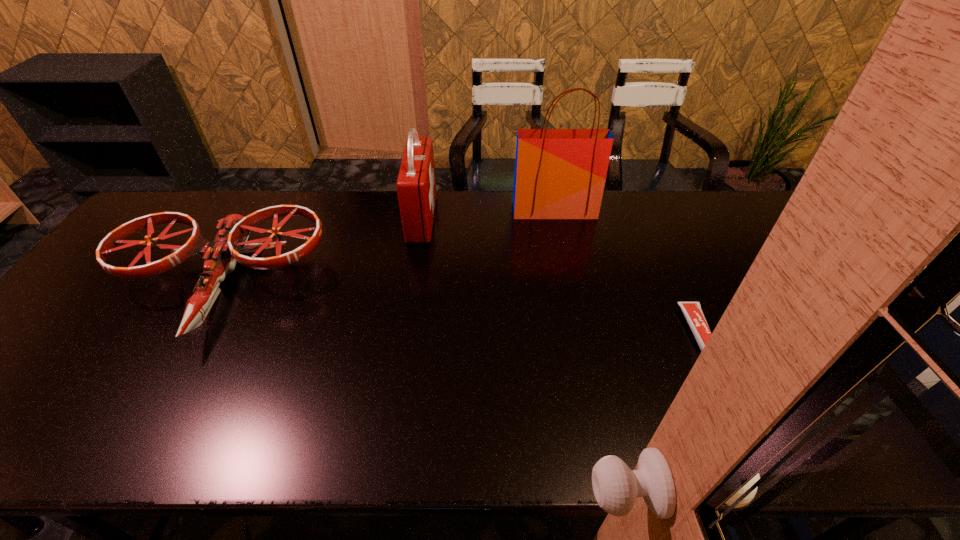
The height and width of the screenshot is (540, 960). I want to click on the tallest object, so click(x=559, y=173).

Image resolution: width=960 pixels, height=540 pixels. In order to click on the third object from left to right in this screenshot , I will do `click(559, 173)`.

The width and height of the screenshot is (960, 540). I want to click on the second tallest object, so click(x=416, y=184).

Locate an element on the screen. Image resolution: width=960 pixels, height=540 pixels. the first-aid kit is located at coordinates (416, 184).

The width and height of the screenshot is (960, 540). What are the coordinates of `the third tallest object` in the screenshot? It's located at (220, 257).

Where is `the leftmost object`? The image size is (960, 540). the leftmost object is located at coordinates (220, 257).

This screenshot has height=540, width=960. I want to click on the rightmost object, so click(x=692, y=311).

Image resolution: width=960 pixels, height=540 pixels. I want to click on the shortest object, so click(692, 311).

Identify the location of free point located on the handle side of the shopping bag. (561, 240).

What are the coordinates of `blank space located 0.190m on the front face of the second tallest object` in the screenshot? It's located at click(x=492, y=218).